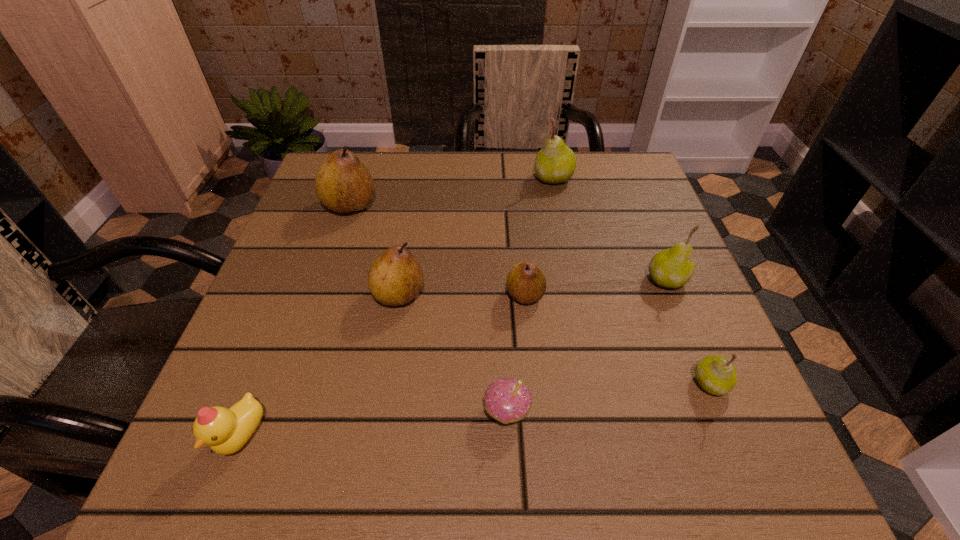
Where is `free space between the nearest green pear and the third object from left to right`? free space between the nearest green pear and the third object from left to right is located at coordinates (555, 339).

Image resolution: width=960 pixels, height=540 pixels. In order to click on free spot between the nearest pear and the second nearest green pear in this screenshot , I will do `click(688, 332)`.

Locate an element on the screen. This screenshot has width=960, height=540. vacant area that lies between the pink cupcake and the nearest pear is located at coordinates (609, 397).

Point out which object is positioned as the third nearest to the farthest object. Please provide its 2D coordinates. Your answer should be formatted as a tuple, i.e. [(x, y)], where the tuple contains the x and y coordinates of a point satisfying the conditions above.

[(343, 184)]

Identify the location of object that is the second closest to the sixth object from left to right. This screenshot has width=960, height=540. (526, 283).

Identify the location of pear that can be found as the second closest to the cupcake. The height and width of the screenshot is (540, 960). (395, 278).

The image size is (960, 540). I want to click on the second closest pear to the second smallest green pear, so click(x=526, y=283).

Find the location of a particular element. the closest green pear relative to the pink cupcake is located at coordinates (716, 375).

Identify which green pear is the second nearest to the rightmost brown pear. Please provide its 2D coordinates. Your answer should be formatted as a tuple, i.e. [(x, y)], where the tuple contains the x and y coordinates of a point satisfying the conditions above.

[(716, 375)]

Image resolution: width=960 pixels, height=540 pixels. Find the location of `the third closest brown pear to the second smallest green pear`. the third closest brown pear to the second smallest green pear is located at coordinates [343, 184].